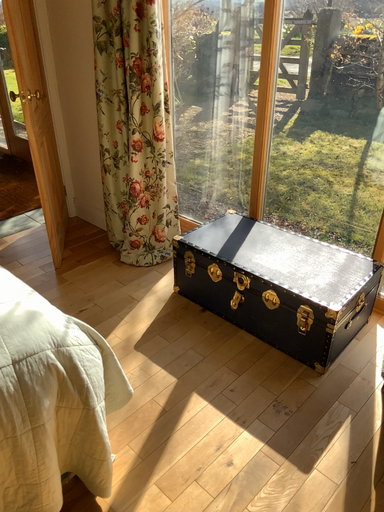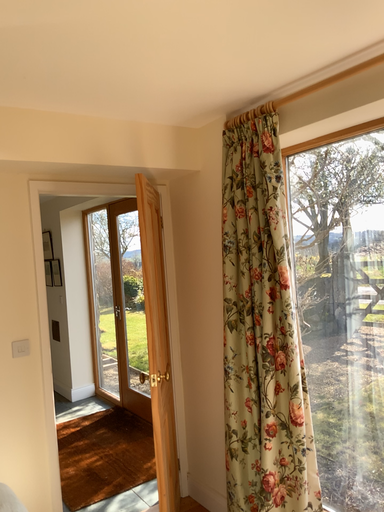
Question: How did the camera likely rotate when shooting the video?

Choices:
 (A) rotated left
 (B) rotated right

Answer: (A)